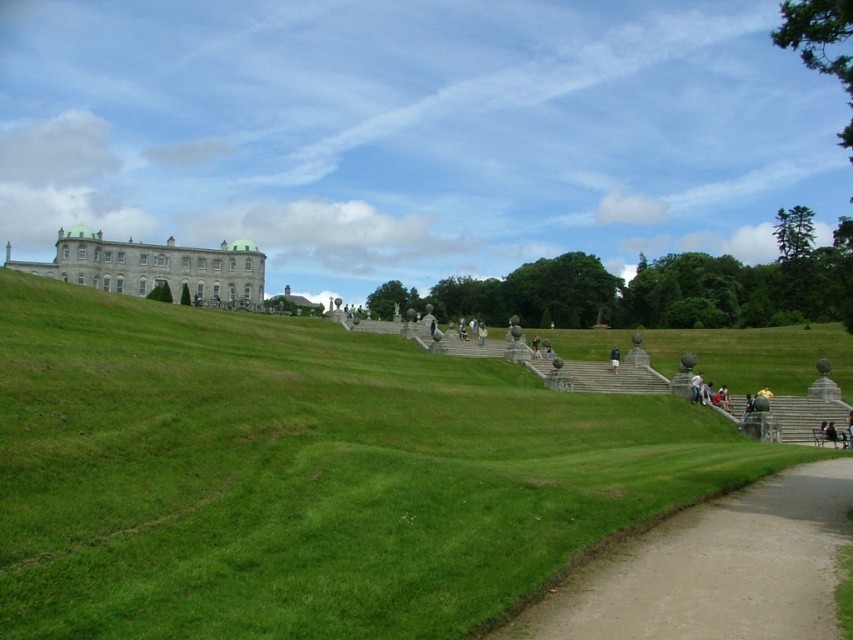
Question: Is green grassy at upper center bigger than dirt/gravel path at lower right?

Choices:
 (A) no
 (B) yes

Answer: (B)

Question: Which point is closer to the camera?

Choices:
 (A) (157, 272)
 (B) (445, 637)

Answer: (B)

Question: Which of the following is the closest to the observer?

Choices:
 (A) dirt/gravel path at lower right
 (B) dark blue jeans at center
 (C) white stone palace at upper left

Answer: (A)

Question: Is dirt/gravel path at lower right closer to camera compared to white stone palace at upper left?

Choices:
 (A) no
 (B) yes

Answer: (B)

Question: Which of the following is the closest to the observer?

Choices:
 (A) (688, 518)
 (B) (260, 253)

Answer: (A)

Question: Is white stone palace at upper left to the right of dark blue jeans at center from the viewer's perspective?

Choices:
 (A) yes
 (B) no

Answer: (B)